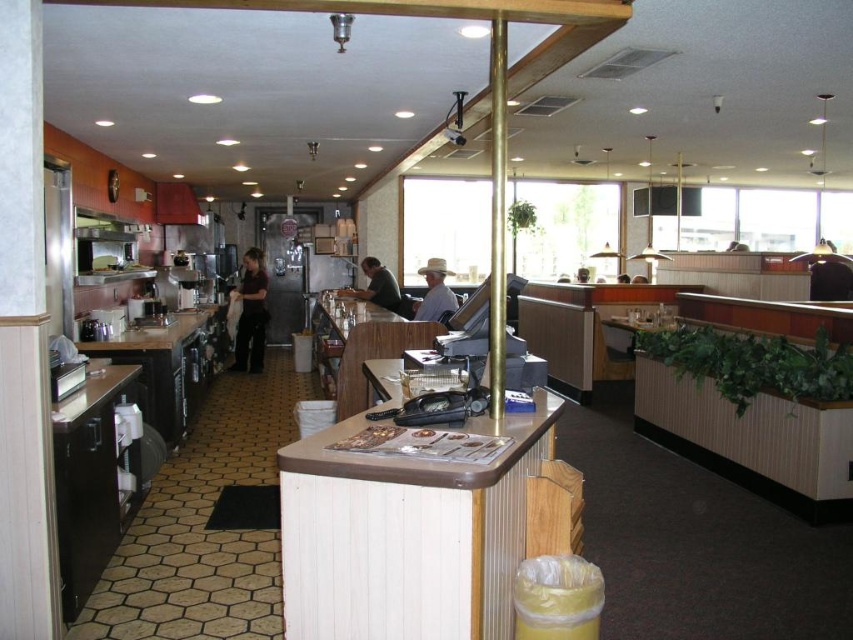
Question: Is the position of dark brown fabric apron at center more distant than that of matte brown cowboy hat at center?

Choices:
 (A) no
 (B) yes

Answer: (B)

Question: Can you confirm if matte brown cowboy hat at center is smaller than matte gray shirt at center?

Choices:
 (A) yes
 (B) no

Answer: (A)

Question: Which point appears farthest from the camera in this image?

Choices:
 (A) (587, 269)
 (B) (252, 269)
 (C) (369, 285)

Answer: (A)

Question: Among these objects, which one is farthest from the camera?

Choices:
 (A) matte brown cowboy hat at center
 (B) matte gray shirt at center

Answer: (B)

Question: Is dark brown fabric apron at center thinner than matte gray shirt at center?

Choices:
 (A) no
 (B) yes

Answer: (B)

Question: Which object appears closest to the camera in this image?

Choices:
 (A) dark brown fabric apron at center
 (B) matte brown cowboy hat at center

Answer: (B)